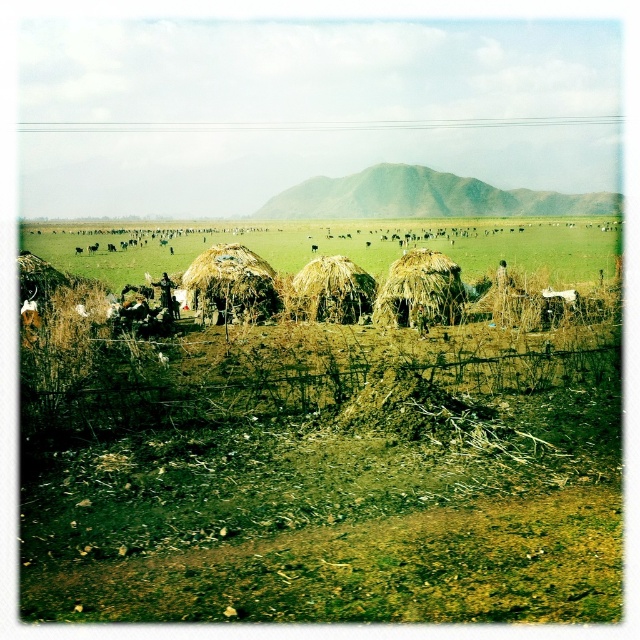
This screenshot has width=640, height=640. Describe the element at coordinates (200, 250) in the screenshot. I see `brown straw huts at center` at that location.

Who is more forward, (516, 225) or (240, 275)?

Point (240, 275) is in front.

The height and width of the screenshot is (640, 640). What are the coordinates of `brown straw huts at center` in the screenshot? It's located at (200, 250).